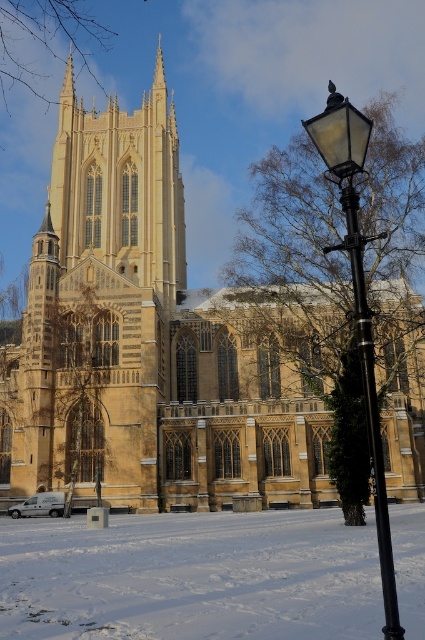
Question: Considering the relative positions of white powdery snow at lower left and golden stone tower at upper center in the image provided, where is white powdery snow at lower left located with respect to golden stone tower at upper center?

Choices:
 (A) below
 (B) above

Answer: (A)

Question: Is white powdery snow at lower left to the right of golden stone tower at upper center from the viewer's perspective?

Choices:
 (A) no
 (B) yes

Answer: (B)

Question: Which is nearer to the golden stone tower at upper center?

Choices:
 (A) white powdery snow at lower left
 (B) black polished metal streetlight at right

Answer: (B)

Question: Considering the real-world distances, which object is farthest from the golden stone tower at upper center?

Choices:
 (A) black polished metal streetlight at right
 (B) white powdery snow at lower left

Answer: (B)

Question: Which point is closer to the camera taking this photo?

Choices:
 (A) (424, 608)
 (B) (173, 113)
 (C) (374, 381)

Answer: (C)

Question: Does white powdery snow at lower left appear on the left side of golden stone tower at upper center?

Choices:
 (A) no
 (B) yes

Answer: (A)